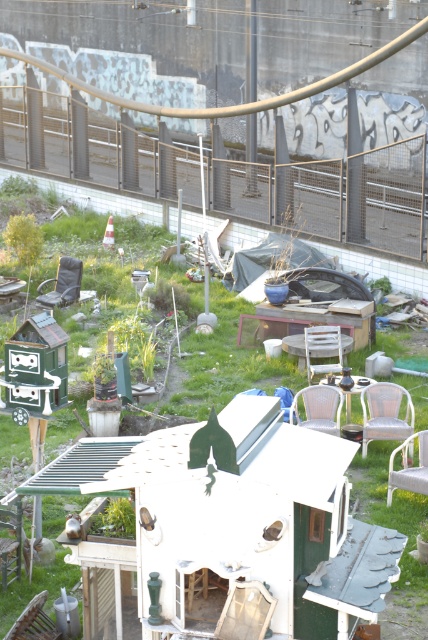
You are standing in the garden and see both the matte black chair at center and the white plastic chair at center. Which one is positioned to the left?

The matte black chair at center is to the left of the white plastic chair at center.

You are standing at the elevated viewpoint of the garden. There are two points marked in the scene. The first point is at coordinates point [0,556] and the second is at point [317,337]. Which of these two points is closer to your current viewpoint?

Point [0,556] is closer to the camera than point [317,337], so the first point is closer to your viewpoint.

You are standing at the viewpoint of the image and want to walk towards the point labeled as point (321,371). As you move forward, will the point labeled point (77,259) come into your line of sight?

Since point (77,259) is behind point (321,371), it will not come into your line of sight as you walk towards point (321,371).